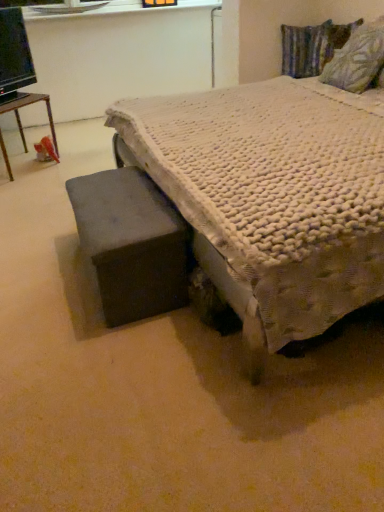
Question: Considering the relative sizes of dark gray fabric ottoman at lower left and textured fabric pillow at upper right, arranged as the 2th pillow when viewed from the top, in the image provided, is dark gray fabric ottoman at lower left shorter than textured fabric pillow at upper right, arranged as the 2th pillow when viewed from the top,?

Choices:
 (A) yes
 (B) no

Answer: (A)

Question: From the image's perspective, would you say dark gray fabric ottoman at lower left is shown under textured fabric pillow at upper right, the 1th pillow from the bottom?

Choices:
 (A) no
 (B) yes

Answer: (B)

Question: Can you confirm if dark gray fabric ottoman at lower left is bigger than textured fabric pillow at upper right, the 1th pillow in the front-to-back sequence?

Choices:
 (A) yes
 (B) no

Answer: (A)

Question: From a real-world perspective, is dark gray fabric ottoman at lower left on top of textured fabric pillow at upper right, the 1th pillow in the front-to-back sequence?

Choices:
 (A) no
 (B) yes

Answer: (A)

Question: Is dark gray fabric ottoman at lower left located outside textured fabric pillow at upper right, the second pillow viewed from the back?

Choices:
 (A) no
 (B) yes

Answer: (B)

Question: Is point (352, 88) positioned closer to the camera than point (246, 118)?

Choices:
 (A) farther
 (B) closer

Answer: (A)

Question: Looking at their shapes, would you say textured fabric pillow at upper right, the second pillow viewed from the back, is wider or thinner than white textured bed at center?

Choices:
 (A) thin
 (B) wide

Answer: (A)

Question: Is textured fabric pillow at upper right, the 1th pillow in the front-to-back sequence, taller or shorter than white textured bed at center?

Choices:
 (A) short
 (B) tall

Answer: (A)

Question: Is textured fabric pillow at upper right, arranged as the 2th pillow when viewed from the top, inside the boundaries of white textured bed at center, or outside?

Choices:
 (A) inside
 (B) outside

Answer: (A)

Question: Considering the positions of point (329, 38) and point (18, 35), is point (329, 38) closer or farther from the camera than point (18, 35)?

Choices:
 (A) closer
 (B) farther

Answer: (B)

Question: Considering their positions, is textured multicolored pillow at upper right, the 2th pillow positioned from the front, located in front of or behind black glossy computer monitor at upper left?

Choices:
 (A) front
 (B) behind

Answer: (B)

Question: Choose the correct answer: Is textured multicolored pillow at upper right, the 2th pillow in the bottom-to-top sequence, inside black glossy computer monitor at upper left or outside it?

Choices:
 (A) outside
 (B) inside

Answer: (A)

Question: Considering the relative positions of textured multicolored pillow at upper right, the 2th pillow positioned from the front, and black glossy computer monitor at upper left in the image provided, is textured multicolored pillow at upper right, the 2th pillow positioned from the front, to the left or to the right of black glossy computer monitor at upper left?

Choices:
 (A) left
 (B) right

Answer: (B)

Question: Relative to wooden table at left, is dark gray fabric ottoman at lower left in front or behind?

Choices:
 (A) front
 (B) behind

Answer: (A)

Question: Based on their sizes in the image, would you say dark gray fabric ottoman at lower left is bigger or smaller than wooden table at left?

Choices:
 (A) big
 (B) small

Answer: (A)